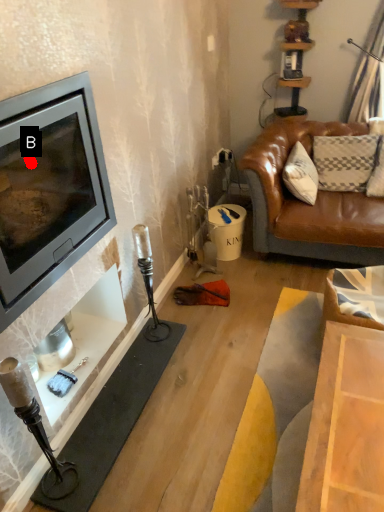
Question: Two points are circled on the image, labeled by A and B beside each circle. Which of the following is the farthest from the observer?

Choices:
 (A) A is further
 (B) B is further

Answer: (B)